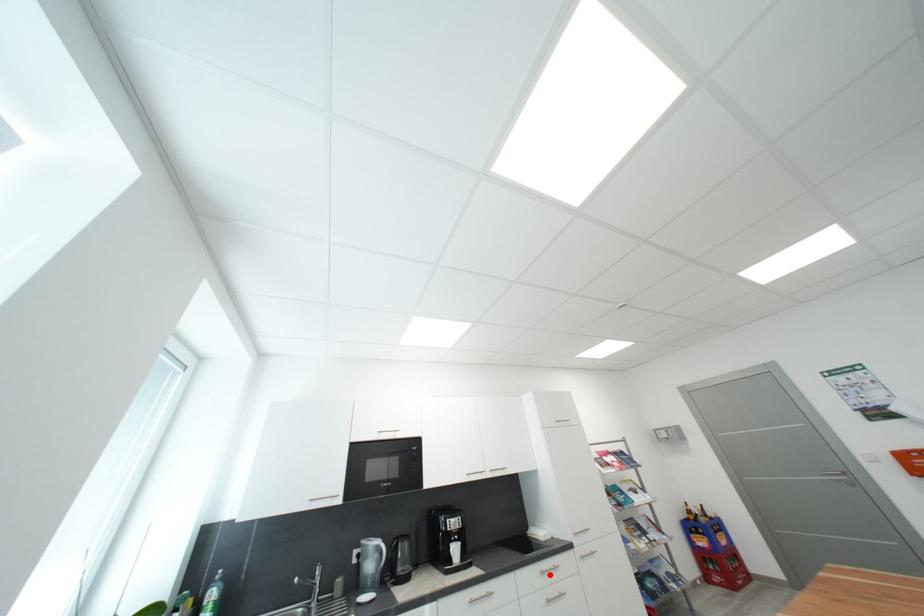
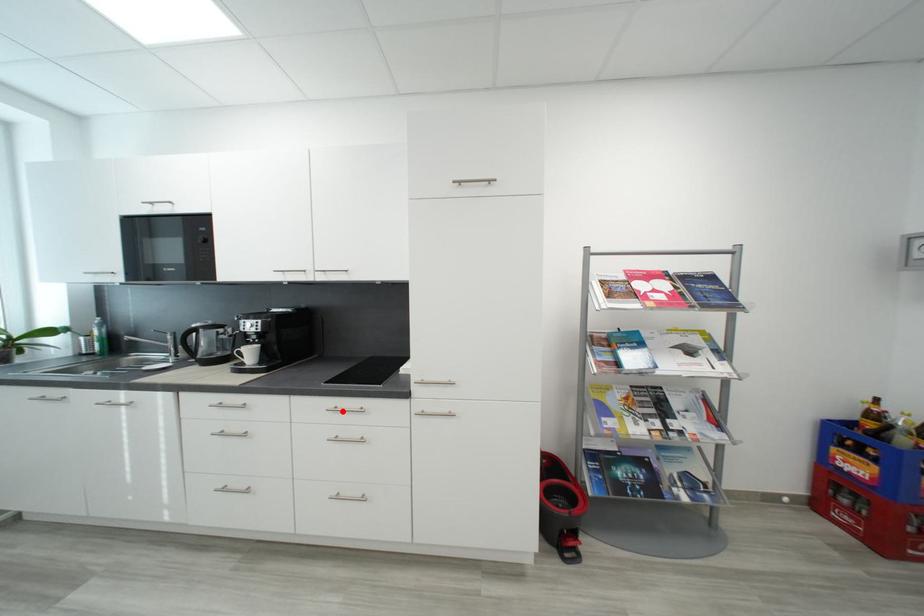
I am providing you with two images of the same scene from different viewpoints. A red point is marked on the first image and another point is marked on the second image. Does the point marked in image1 correspond to the same location as the one in image2?

Yes